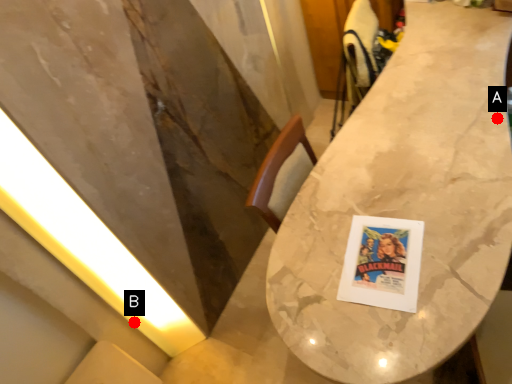
Question: Two points are circled on the image, labeled by A and B beside each circle. Which point appears farthest from the camera in this image?

Choices:
 (A) A is further
 (B) B is further

Answer: (B)